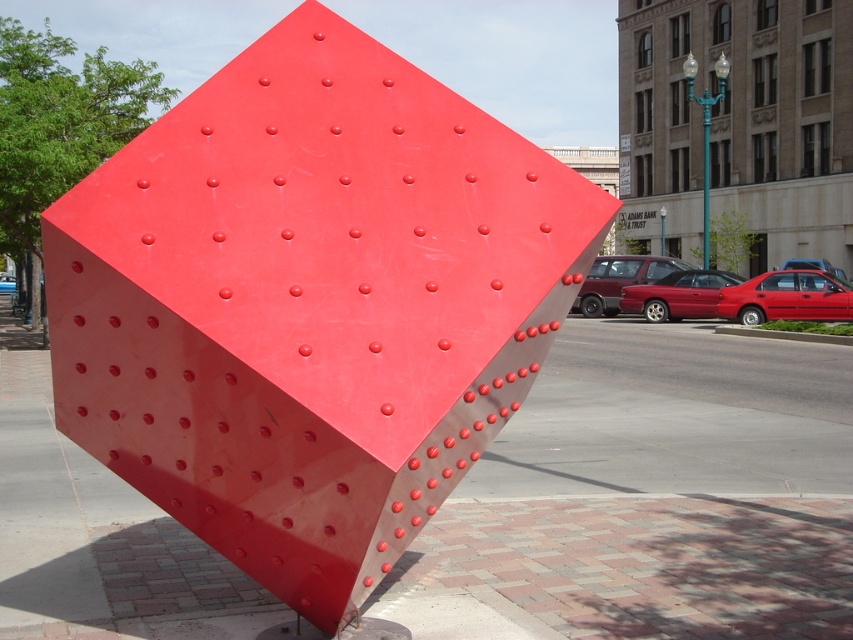
Question: Among these objects, which one is farthest from the camera?

Choices:
 (A) glossy red cube at center
 (B) glossy concrete pavement at center

Answer: (B)

Question: Can you confirm if glossy red cube at center is positioned above glossy concrete pavement at center?

Choices:
 (A) no
 (B) yes

Answer: (B)

Question: Can you confirm if glossy red cube at center is positioned below glossy concrete pavement at center?

Choices:
 (A) no
 (B) yes

Answer: (A)

Question: Which object is closer to the camera taking this photo?

Choices:
 (A) glossy red cube at center
 (B) glossy concrete pavement at center

Answer: (A)

Question: Which of the following is the farthest from the observer?

Choices:
 (A) (328, 602)
 (B) (479, 564)

Answer: (B)

Question: Does glossy red cube at center appear on the right side of glossy concrete pavement at center?

Choices:
 (A) no
 (B) yes

Answer: (A)